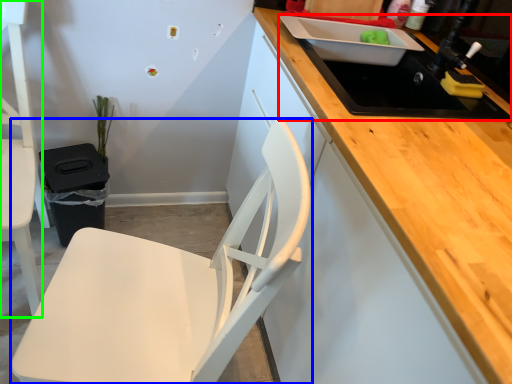
Question: Based on their relative distances, which object is nearer to sink (highlighted by a red box)? Choose from chair (highlighted by a blue box) and chair (highlighted by a green box).

Choices:
 (A) chair
 (B) chair

Answer: (A)